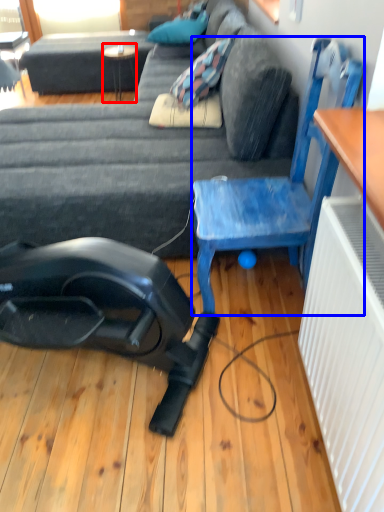
Question: Which object appears farthest to the camera in this image, table (highlighted by a red box) or chair (highlighted by a blue box)?

Choices:
 (A) table
 (B) chair

Answer: (A)